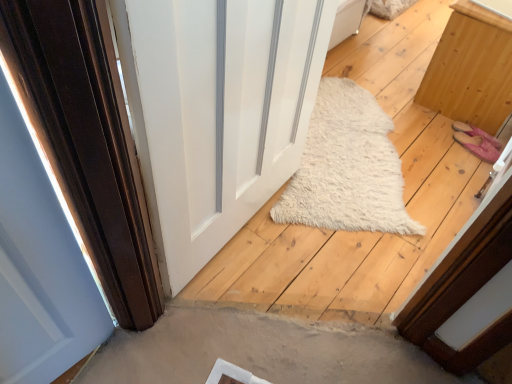
Question: Is white glossy door at center bigger or smaller than light brown wood cabinet at right?

Choices:
 (A) big
 (B) small

Answer: (B)

Question: Is white glossy door at center inside the boundaries of light brown wood cabinet at right, or outside?

Choices:
 (A) inside
 (B) outside

Answer: (B)

Question: In the image, is white glossy door at center on the left side or the right side of light brown wood cabinet at right?

Choices:
 (A) left
 (B) right

Answer: (A)

Question: In terms of size, does light brown wood cabinet at right appear bigger or smaller than white glossy door at center?

Choices:
 (A) big
 (B) small

Answer: (A)

Question: Is light brown wood cabinet at right situated inside white glossy door at center or outside?

Choices:
 (A) inside
 (B) outside

Answer: (B)

Question: Considering the relative positions of light brown wood cabinet at right and white glossy door at center in the image provided, is light brown wood cabinet at right to the left or to the right of white glossy door at center?

Choices:
 (A) right
 (B) left

Answer: (A)

Question: From the image's perspective, is light brown wood cabinet at right above or below white glossy door at center?

Choices:
 (A) above
 (B) below

Answer: (A)